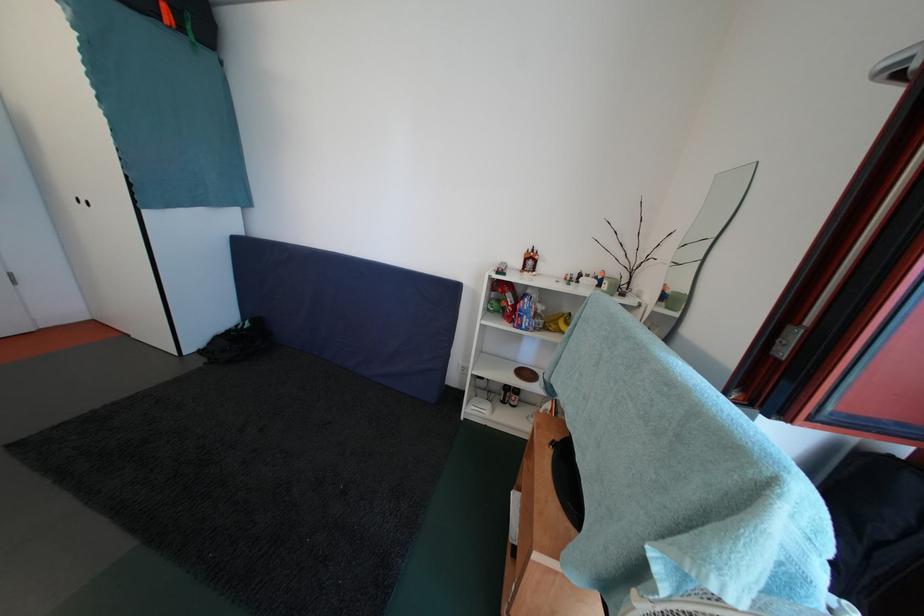
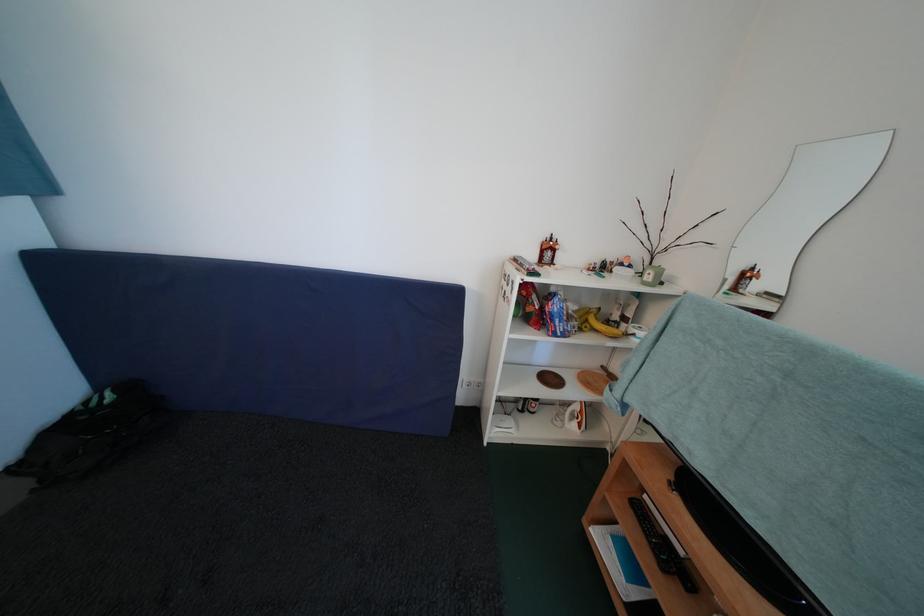
Locate, in the second image, the point that corresponds to point (539, 414) in the first image.

(561, 416)